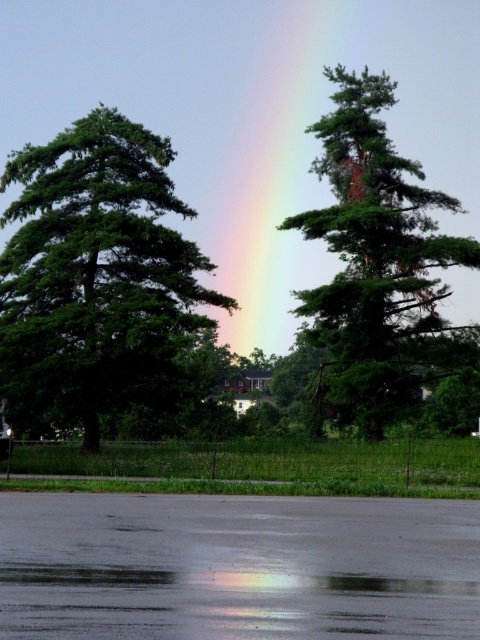
Is green leafy tree at left wider than green matte tree at center?

In fact, green leafy tree at left might be narrower than green matte tree at center.

Can you confirm if green leafy tree at left is bigger than green matte tree at center?

Incorrect, green leafy tree at left is not larger than green matte tree at center.

Identify the location of green leafy tree at left. The width and height of the screenshot is (480, 640). (96, 276).

Where is `green leafy tree at left`? green leafy tree at left is located at coordinates (96, 276).

The width and height of the screenshot is (480, 640). Describe the element at coordinates (96, 276) in the screenshot. I see `green leafy tree at left` at that location.

Can you confirm if green leafy tree at left is thinner than rainbow at center?

Yes.

Between point (54, 150) and point (261, 102), which one is positioned in front?

Positioned in front is point (54, 150).

This screenshot has height=640, width=480. I want to click on green leafy tree at left, so click(96, 276).

Does point (374, 404) lie in front of point (276, 305)?

That is True.

Can you confirm if green matte tree at center is positioned to the left of rainbow at center?

In fact, green matte tree at center is to the right of rainbow at center.

Which is in front, point (365, 291) or point (309, 273)?

Point (365, 291)

The height and width of the screenshot is (640, 480). Find the location of `green matte tree at center`. green matte tree at center is located at coordinates (379, 264).